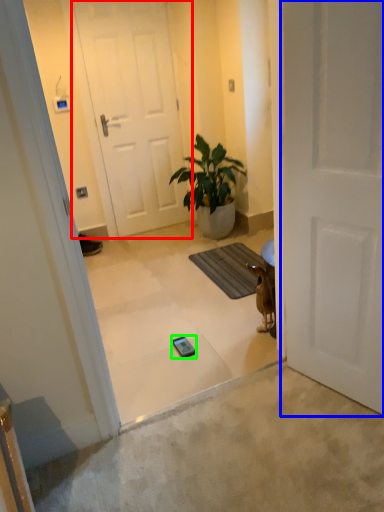
Question: Estimate the real-world distances between objects in this image. Which object is farther from door (highlighted by a red box), door (highlighted by a blue box) or mobile phone (highlighted by a green box)?

Choices:
 (A) door
 (B) mobile phone

Answer: (A)